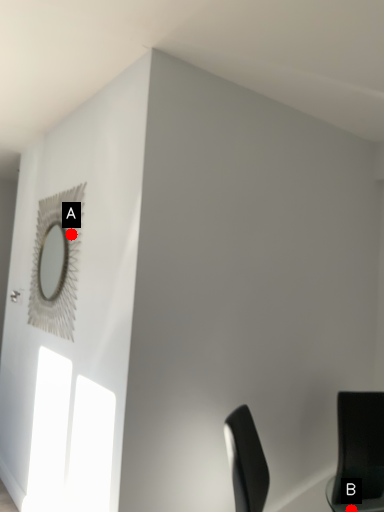
Question: Two points are circled on the image, labeled by A and B beside each circle. Among these points, which one is nearest to the camera?

Choices:
 (A) A is closer
 (B) B is closer

Answer: (B)